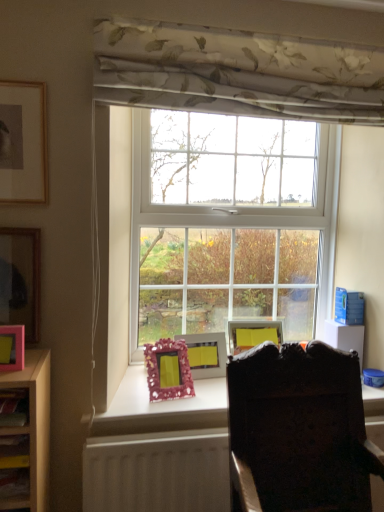
I want to click on vacant region in front of matte pink picture frame at center, which is the second picture frame from bottom to top, so click(x=209, y=388).